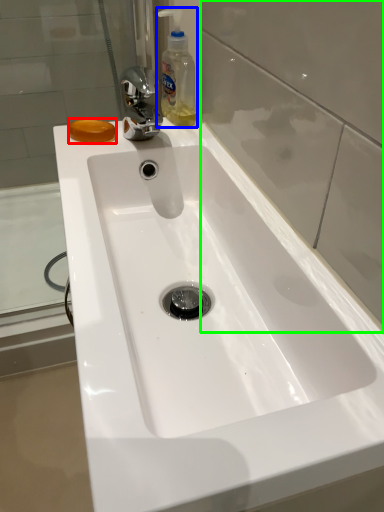
Question: Which is farther away from soap (highlighted by a red box)? cleaning product (highlighted by a blue box) or glass door (highlighted by a green box)?

Choices:
 (A) cleaning product
 (B) glass door

Answer: (B)